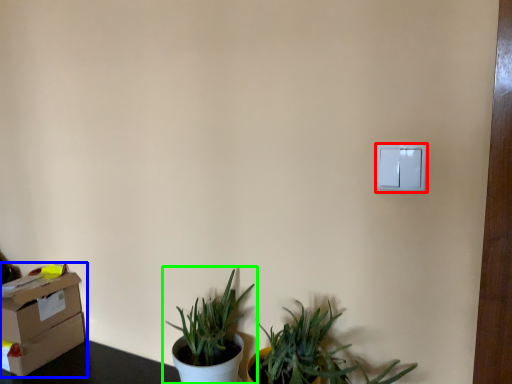
Question: Estimate the real-world distances between objects in this image. Which object is farther from light switch (highlighted by a red box), cardboard box (highlighted by a blue box) or houseplant (highlighted by a green box)?

Choices:
 (A) cardboard box
 (B) houseplant

Answer: (A)